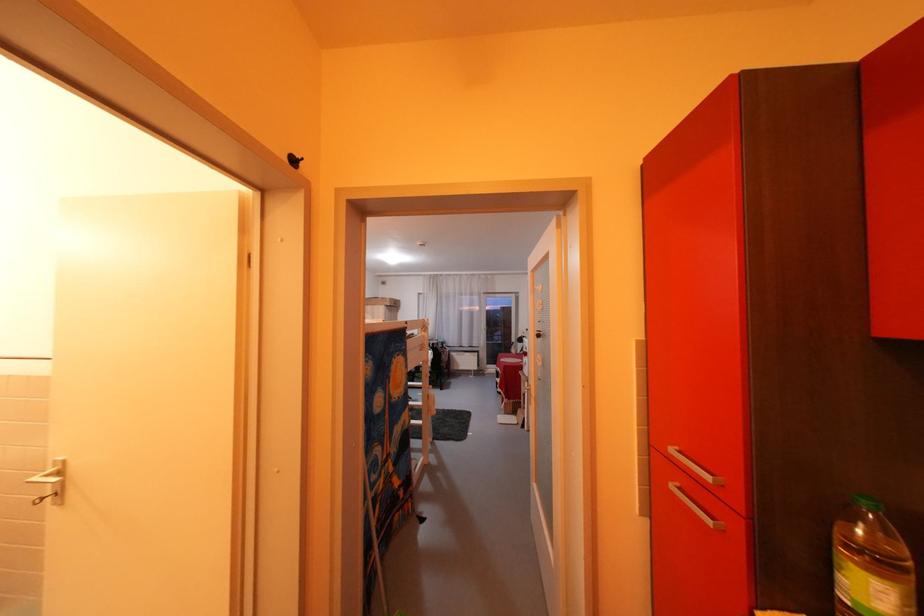
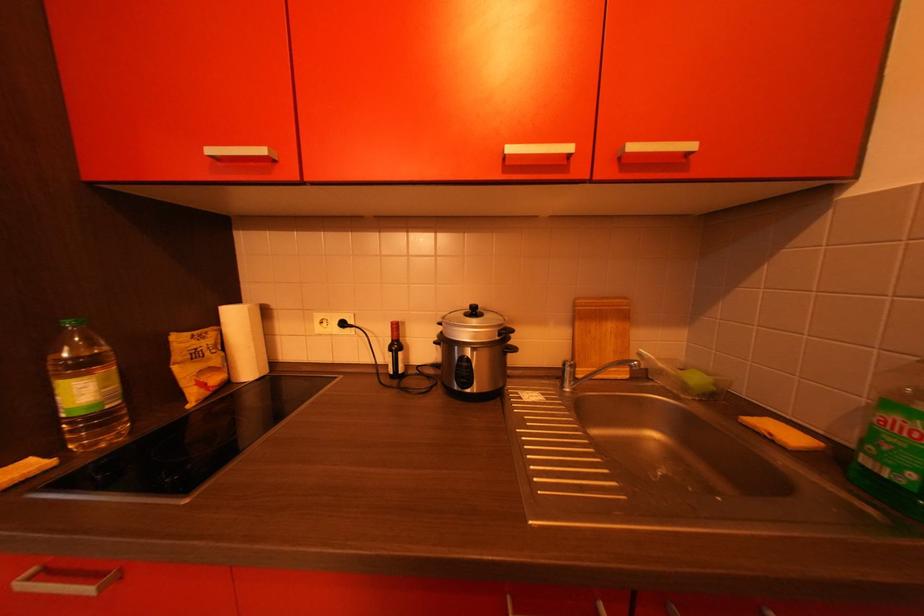
Question: Based on the continuous images, in which direction is the camera rotating? Reply with the corresponding letter.

Choices:
 (A) Left
 (B) Right
 (C) Up
 (D) Down

Answer: (B)